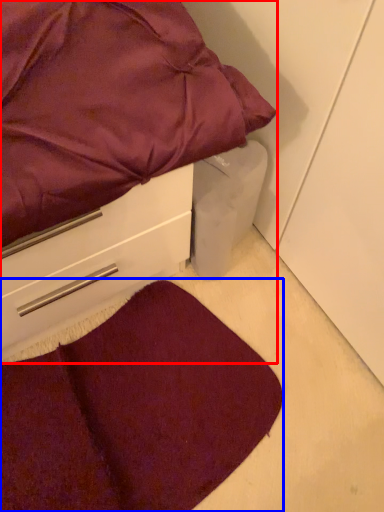
Question: Which object is closer to the camera taking this photo, bed (highlighted by a red box) or mat (highlighted by a blue box)?

Choices:
 (A) bed
 (B) mat

Answer: (A)